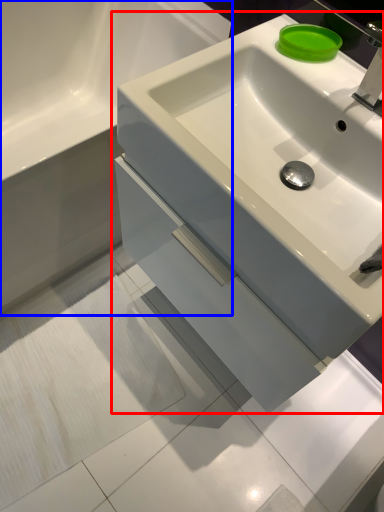
Question: Which point is closer to the camera, sink (highlighted by a red box) or bathroom cabinet (highlighted by a blue box)?

Choices:
 (A) sink
 (B) bathroom cabinet

Answer: (A)